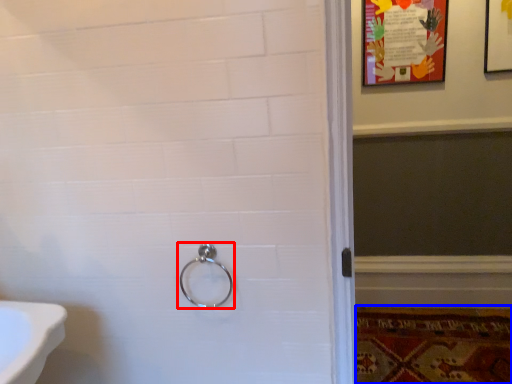
Question: Among these objects, which one is nearest to the camera, door handle (highlighted by a red box) or mat (highlighted by a blue box)?

Choices:
 (A) door handle
 (B) mat

Answer: (A)